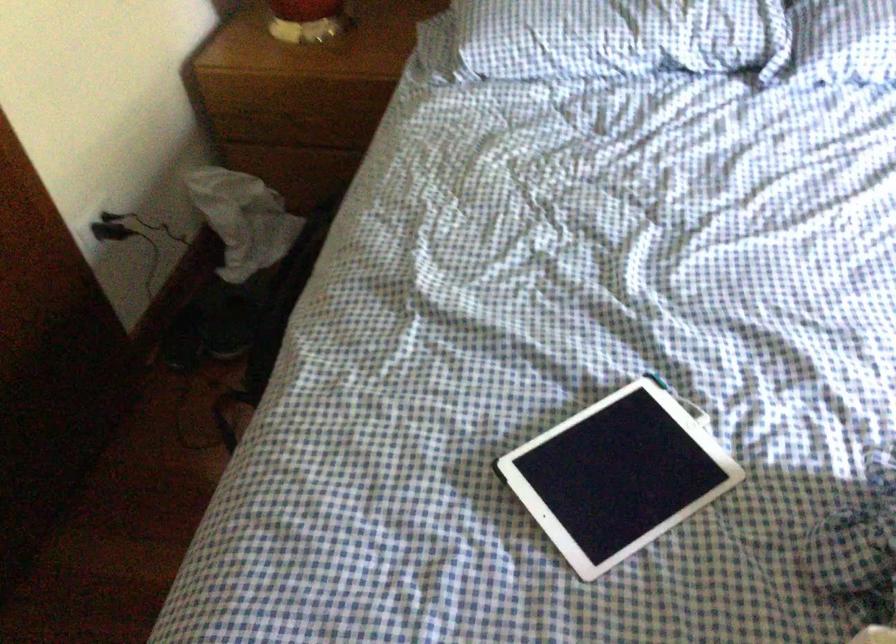
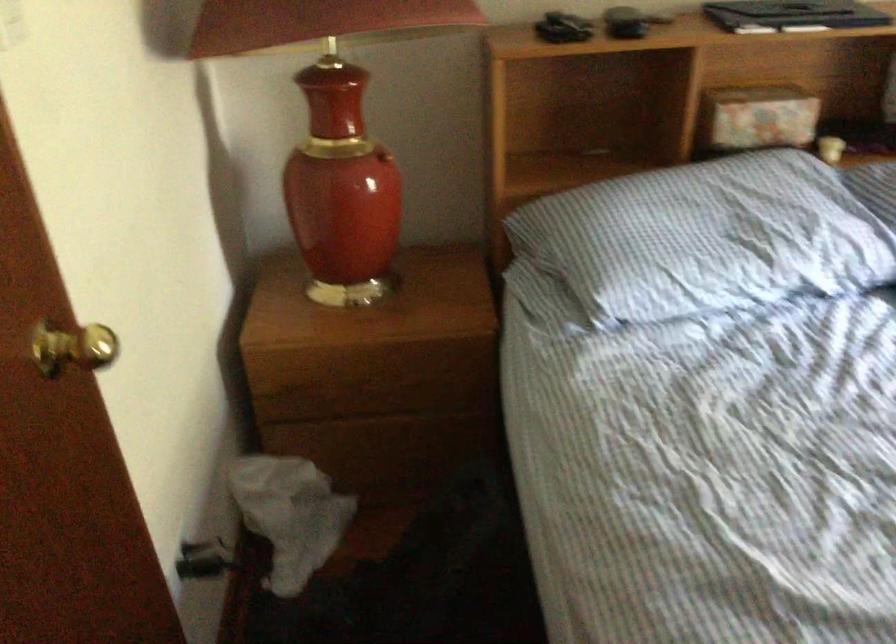
Find the pixel in the second image that matches point (233, 218) in the first image.

(289, 515)